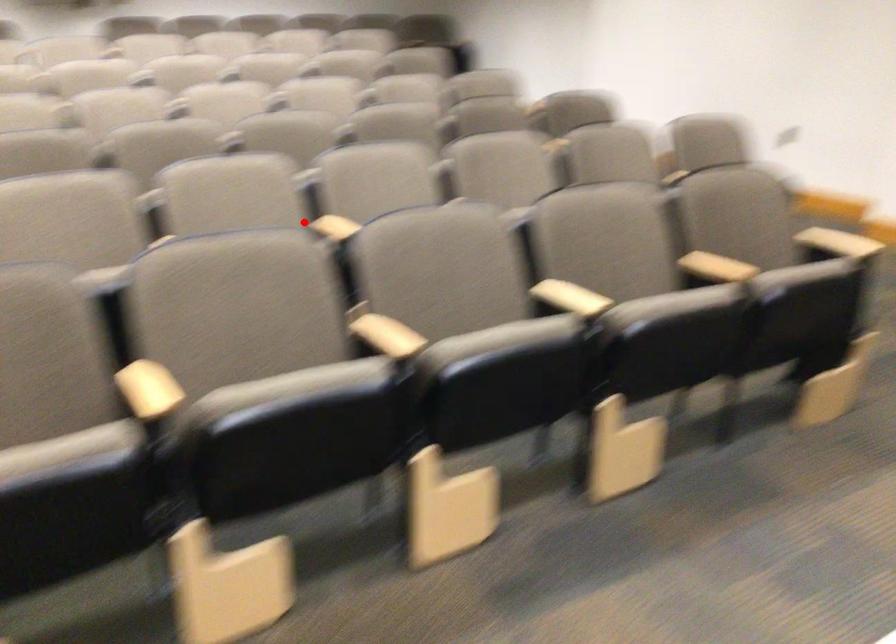
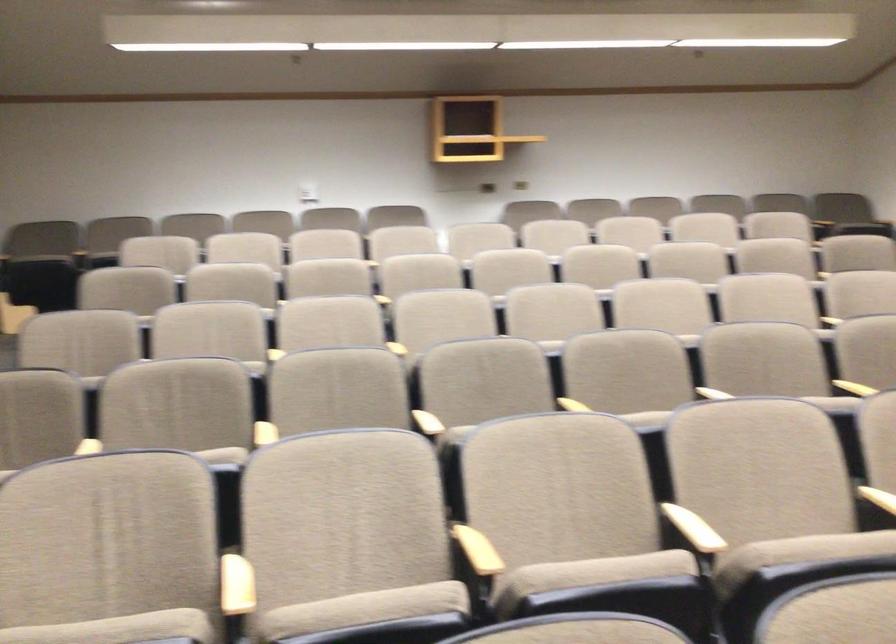
Question: I am providing you with two images of the same scene from different viewpoints. Image1 has a red point marked. In image2, the corresponding 3D location appears at what relative position? Reply with the corresponding letter.

Choices:
 (A) Closer
 (B) Farther

Answer: (A)